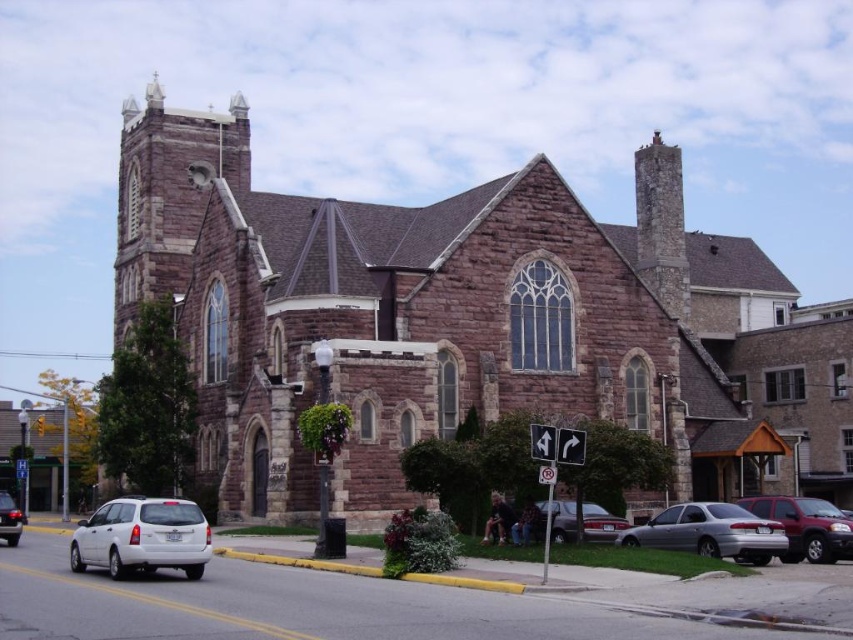
You are standing in front of the historic stone church and see a point marked at coordinate (x=805, y=525). What object is located at this coordinate?

The point at coordinate (x=805, y=525) indicates a matte red suv at lower right.

You are a delivery person who needs to park a 1.8 meter tall delivery van. You see the matte red suv at lower right and the white matte sedan at lower left in the parking lot. Can your van fit between them if they are parked parallel to each other?

The matte red suv at lower right is taller than the white matte sedan at lower left. Since the van is 1.8 meters tall, it depends on the height of the SUV. If the SUV is taller than 1.8 meters, the van cannot fit. If the SUV is shorter, it might. However, without exact measurements, we can only compare their heights, not determine the exact space available.